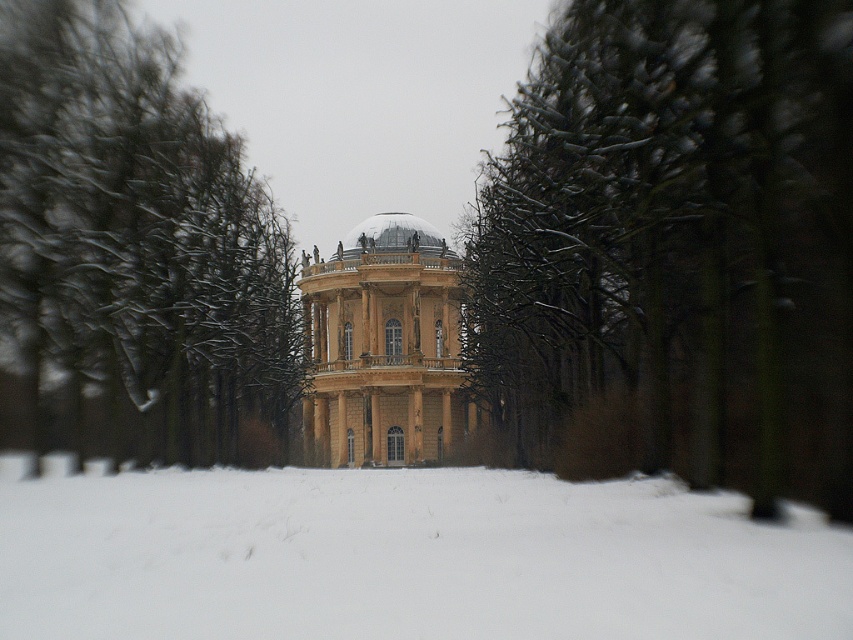
Question: Among these points, which one is farthest from the camera?

Choices:
 (A) (112, 380)
 (B) (399, 332)
 (C) (351, 253)
 (D) (572, 131)

Answer: (C)

Question: Can you confirm if snow-covered branches at center is positioned to the right of golden stone palace at center?

Choices:
 (A) yes
 (B) no

Answer: (A)

Question: Which point is farther to the camera?

Choices:
 (A) snow-covered branches at center
 (B) golden stone palace at center

Answer: (B)

Question: In this image, where is golden stone palace at center located relative to shiny gold dome at center?

Choices:
 (A) above
 (B) below

Answer: (B)

Question: Where is white fluffy snow at lower center located in relation to snow-covered branches at left in the image?

Choices:
 (A) below
 (B) above

Answer: (A)

Question: Among these points, which one is farthest from the camera?

Choices:
 (A) 358,250
 (B) 68,205
 (C) 334,417
 (D) 851,326

Answer: (A)